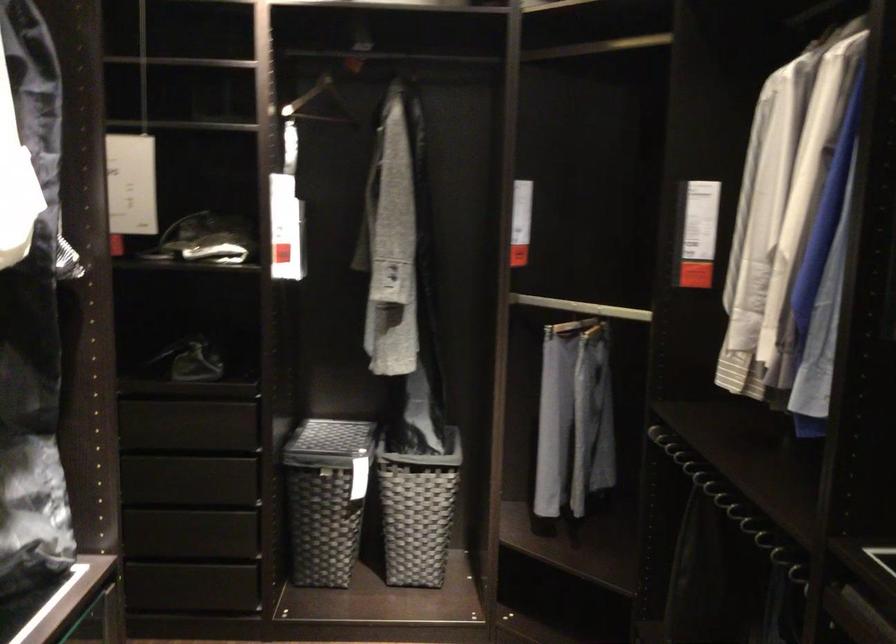
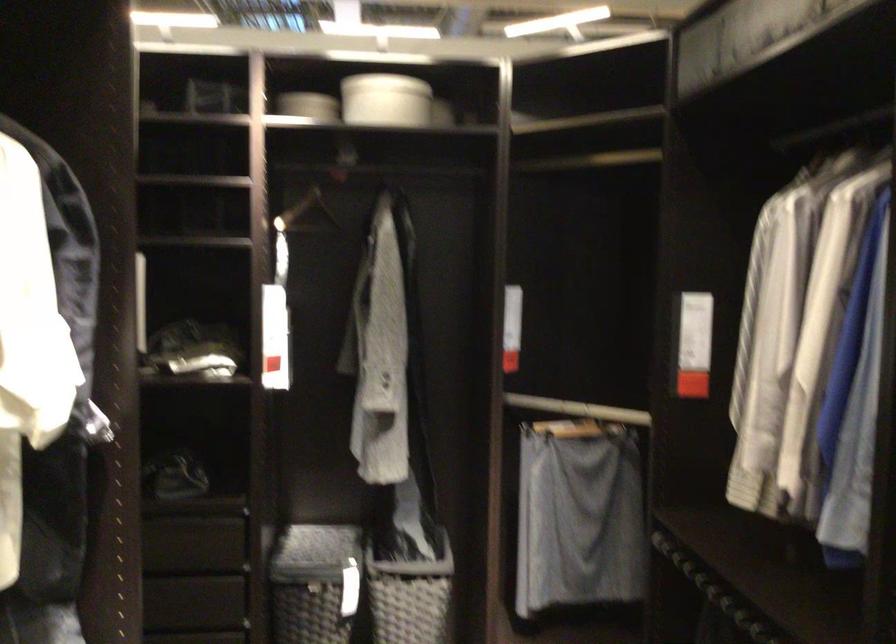
Question: The images are taken continuously from a first-person perspective. In which direction is your viewpoint rotating?

Choices:
 (A) Left
 (B) Right
 (C) Up
 (D) Down

Answer: (C)